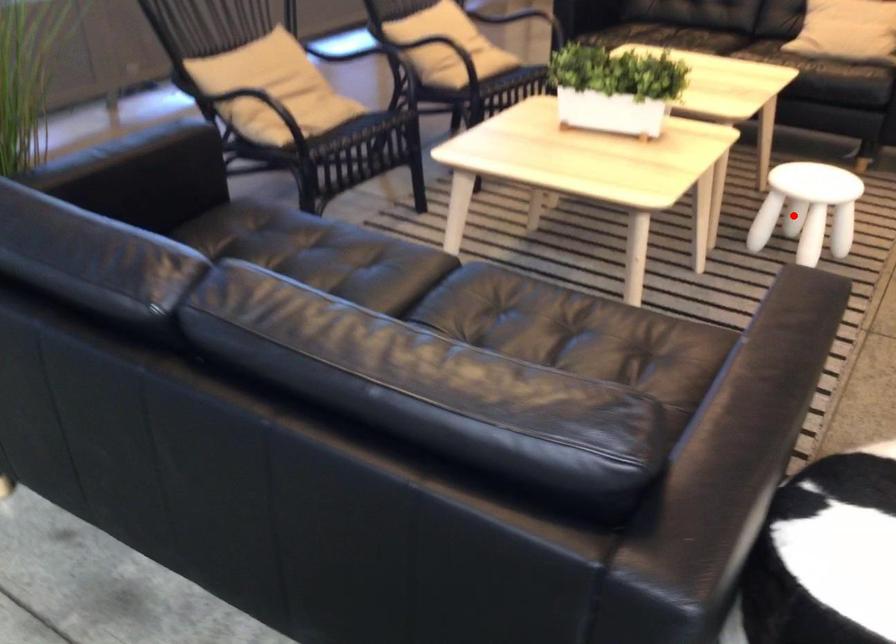
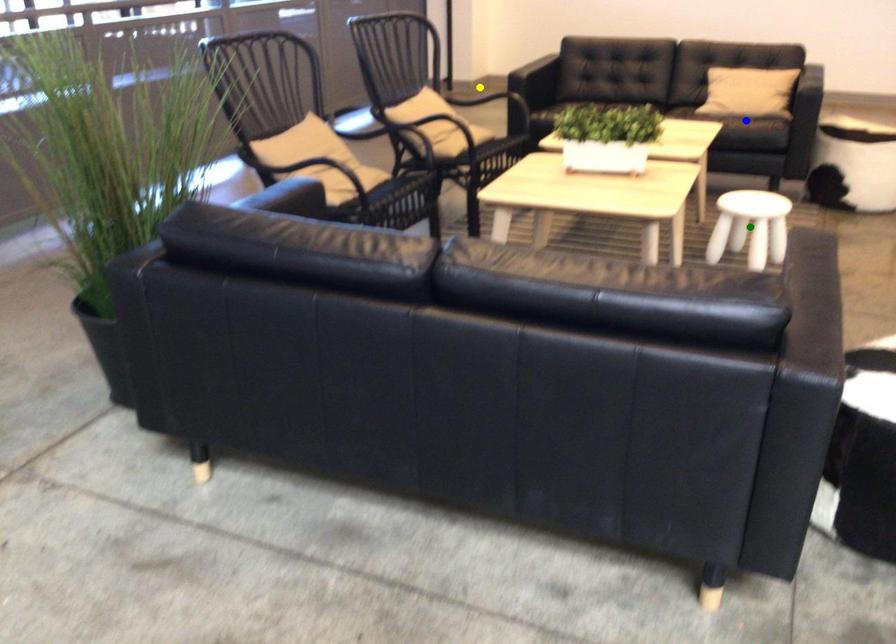
Question: I am providing you with two images of the same scene from different viewpoints. A red point is marked on the first image. You are given multiple points on the second image. Which point in image 2 is actually the same real-world point as the red point in image 1?

Choices:
 (A) green point
 (B) blue point
 (C) yellow point

Answer: (A)